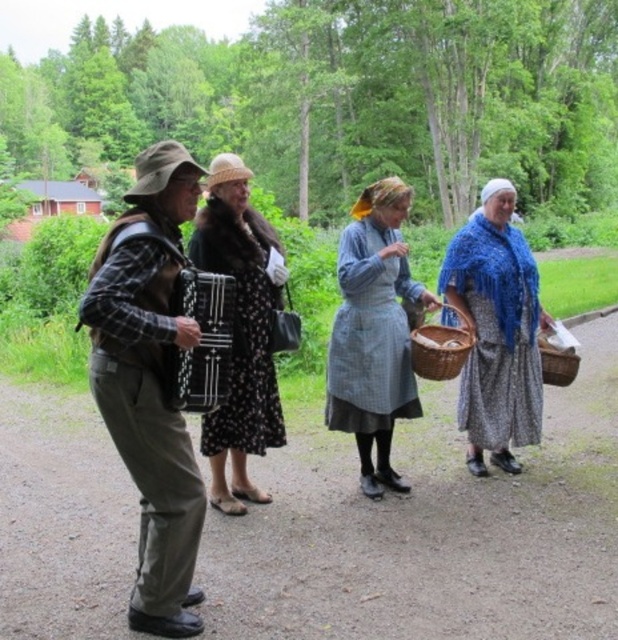
Question: Is woven brown basket at lower right smaller than brown woven basket at center?

Choices:
 (A) yes
 (B) no

Answer: (A)

Question: Which point is farther to the camera?

Choices:
 (A) (442, 272)
 (B) (459, 339)

Answer: (A)

Question: Is woven brown basket at lower right to the left of brown woven basket at center from the viewer's perspective?

Choices:
 (A) no
 (B) yes

Answer: (A)

Question: Which object is the farthest from the brown woven basket at center?

Choices:
 (A) plaid fabric accordion at center
 (B) black dotted dress at center

Answer: (A)

Question: Based on their relative distances, which object is nearer to the blue knitted shawl at right?

Choices:
 (A) woven brown basket at center
 (B) blue plaid dress at center
 (C) plaid fabric accordion at center
 (D) brown woven basket at center

Answer: (D)

Question: Does blue plaid dress at center appear under woven brown basket at lower right?

Choices:
 (A) yes
 (B) no

Answer: (B)